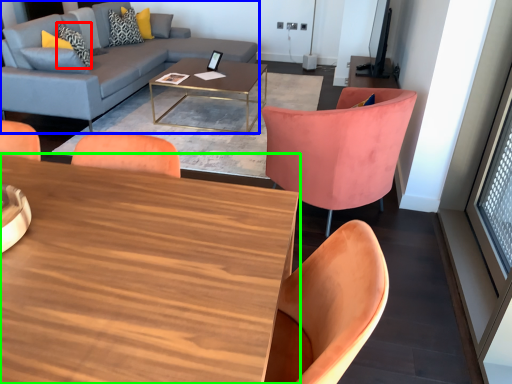
Question: Which object is the closest to the pillow (highlighted by a red box)? Choose among these: studio couch (highlighted by a blue box) or coffee table (highlighted by a green box).

Choices:
 (A) studio couch
 (B) coffee table

Answer: (A)